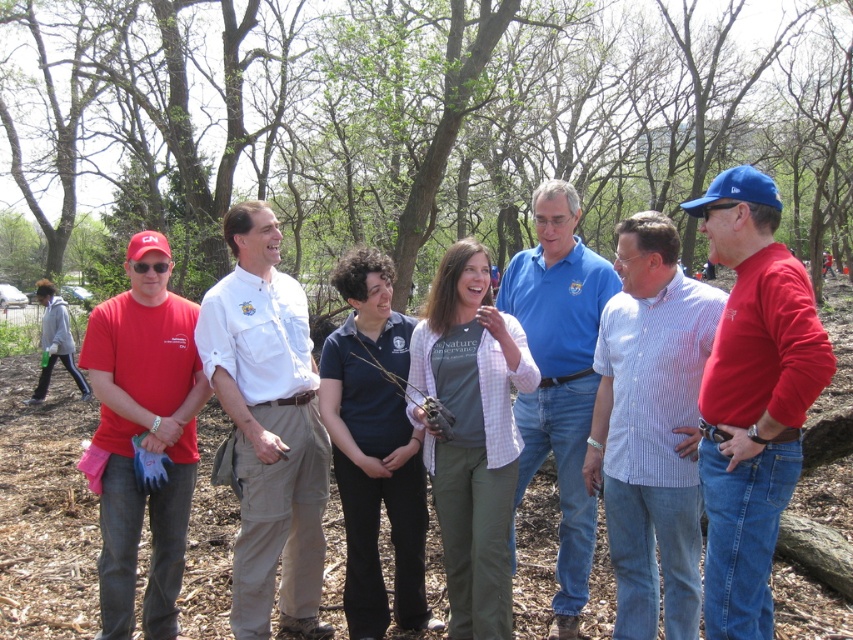
Question: Is red cotton shirt at center thinner than dark blue shirt at center?

Choices:
 (A) no
 (B) yes

Answer: (B)

Question: Which object appears farthest from the camera in this image?

Choices:
 (A) white cotton shirt at center
 (B) red cotton shirt at center

Answer: (A)

Question: Is green leafy tree at center positioned behind white striped shirt at center?

Choices:
 (A) yes
 (B) no

Answer: (A)

Question: Which is nearer to the blue cotton shirt at center?

Choices:
 (A) matte red t-shirt at left
 (B) red cotton shirt at center

Answer: (B)

Question: Which point appears closest to the camera in this image?

Choices:
 (A) (437, 272)
 (B) (779, 374)
 (C) (370, 406)

Answer: (B)

Question: Is white cotton shirt at center thinner than blue cotton shirt at center?

Choices:
 (A) no
 (B) yes

Answer: (A)